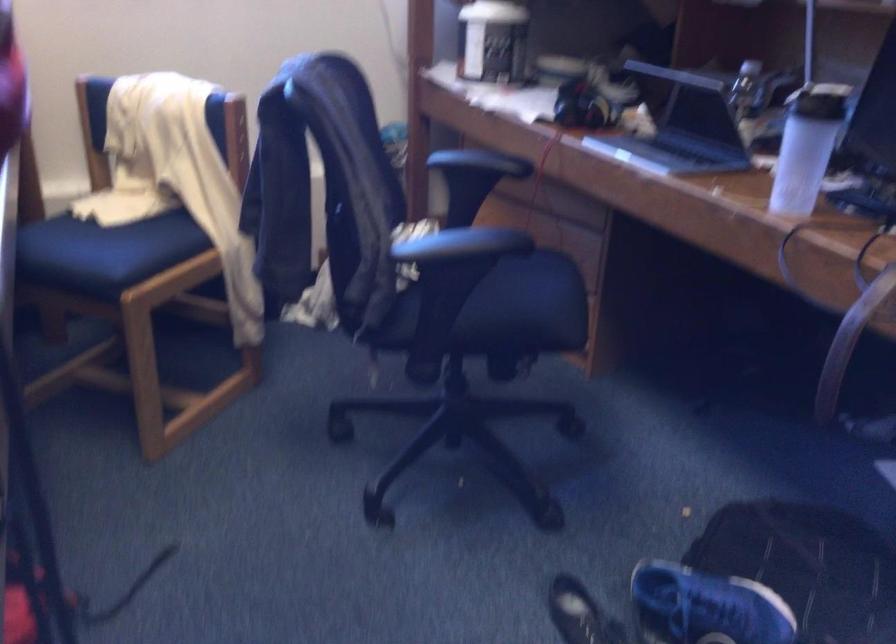
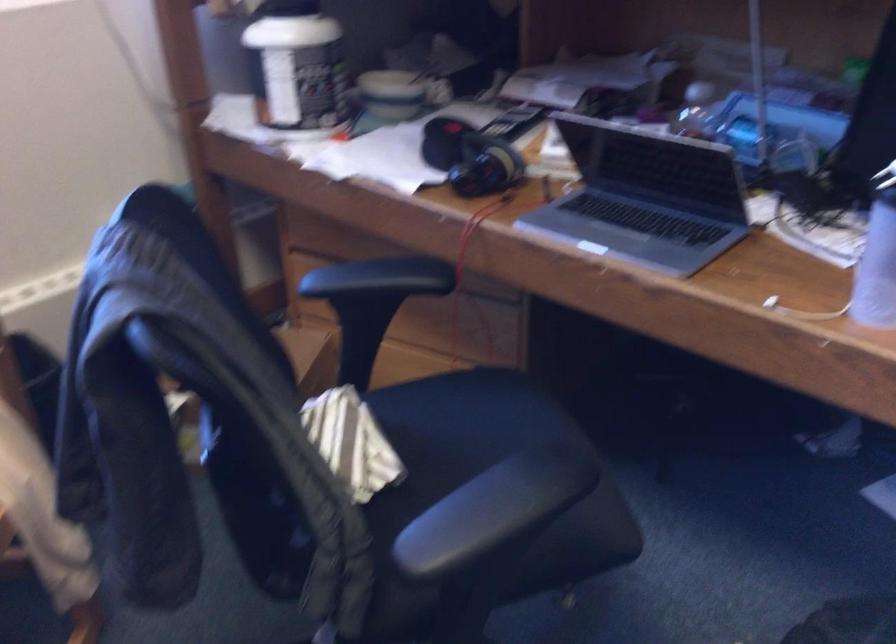
The point at (435,249) is marked in the first image. Where is the corresponding point in the second image?

(471, 529)